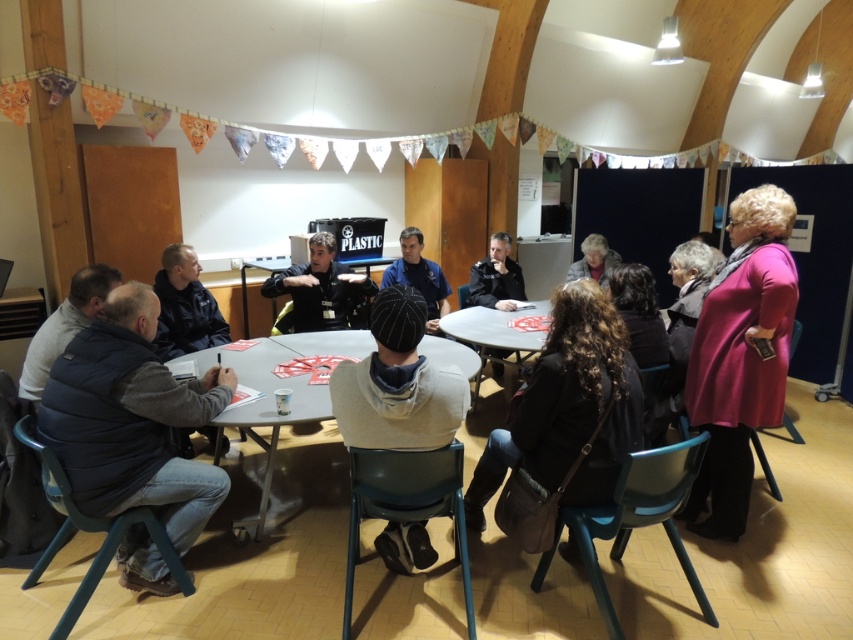
Can you confirm if gray matte vest at lower left is thinner than white plastic table at center?

Indeed, gray matte vest at lower left has a lesser width compared to white plastic table at center.

I want to click on gray matte vest at lower left, so click(x=64, y=324).

Does striped knit cap at center appear on the right side of matte black hair at upper center?

Incorrect, striped knit cap at center is not on the right side of matte black hair at upper center.

Which is more to the right, striped knit cap at center or matte black hair at upper center?

matte black hair at upper center is more to the right.

You are a GUI agent. You are given a task and a screenshot of the screen. Output one action in this format:
    pyautogui.click(x=<x>, y=<y>)
    Task: Click on the striped knit cap at center
    This screenshot has height=640, width=853.
    Given the screenshot: What is the action you would take?
    pyautogui.click(x=397, y=384)

Where is `striped knit cap at center`? The height and width of the screenshot is (640, 853). striped knit cap at center is located at coordinates (397, 384).

Is point (38, 387) closer to camera compared to point (599, 234)?

Yes.

Is gray matte vest at lower left above matte black hair at upper center?

No.

What are the coordinates of `gray matte vest at lower left` in the screenshot? It's located at (64, 324).

The width and height of the screenshot is (853, 640). Find the location of `gray matte vest at lower left`. gray matte vest at lower left is located at coordinates (64, 324).